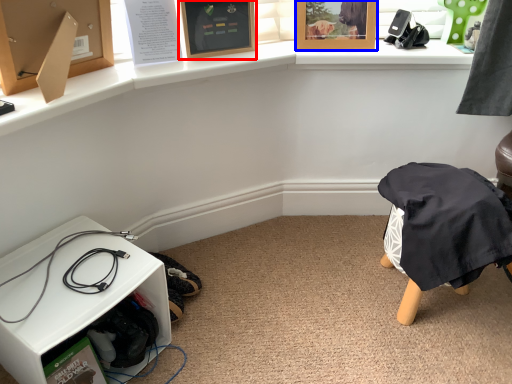
Question: Which object appears closest to the camera in this image, picture frame (highlighted by a red box) or picture frame (highlighted by a blue box)?

Choices:
 (A) picture frame
 (B) picture frame

Answer: (A)